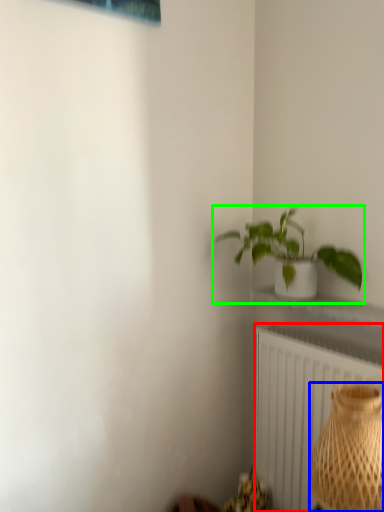
Question: Estimate the real-world distances between objects in this image. Which object is farther from radiator (highlighted by a red box), vase (highlighted by a blue box) or houseplant (highlighted by a green box)?

Choices:
 (A) vase
 (B) houseplant

Answer: (B)